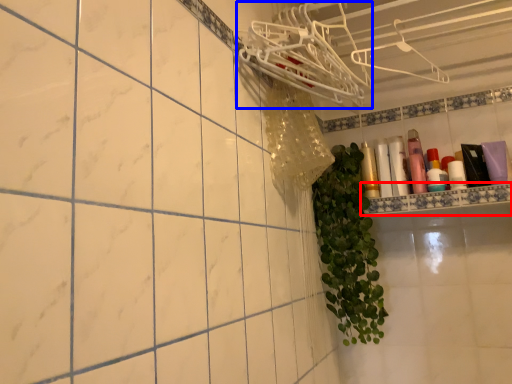
Question: Which object appears closest to the camera in this image, ledge (highlighted by a red box) or hanger (highlighted by a blue box)?

Choices:
 (A) ledge
 (B) hanger

Answer: (B)